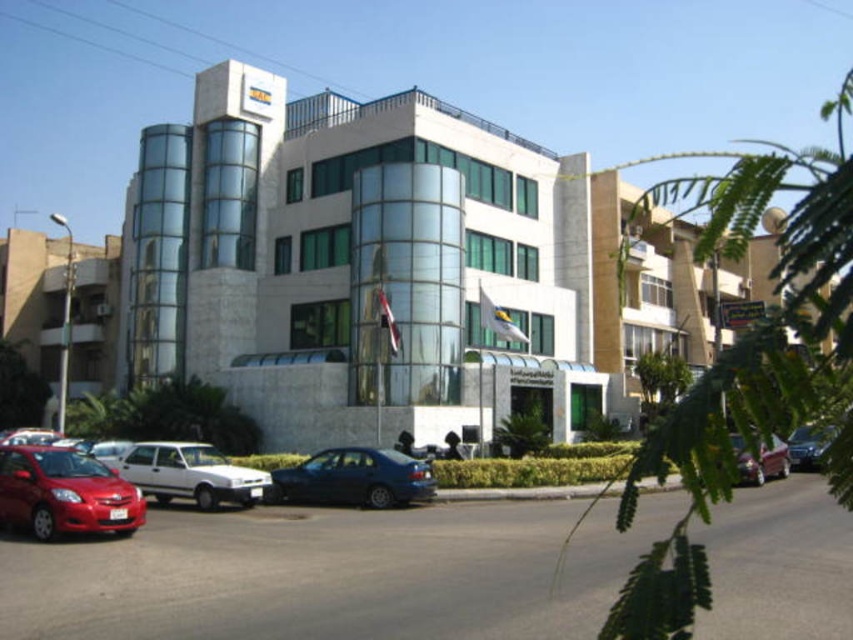
Looking at this image, you are standing at the entrance of the building and see the shiny red sedan at lower left. What is the spatial relationship between the shiny red sedan at lower left and the point marked at coordinates (x=64, y=492)?

The point marked at coordinates (x=64, y=492) corresponds to the shiny red sedan at lower left.

Based on the photo, you are driving a car and want to park in the parking lot near the shiny blue sedan at center and the metallic blue sedan at center. Which one should you park to the right side of?

You should park to the right side of the metallic blue sedan at center because the shiny blue sedan at center is already positioned to the left of it.